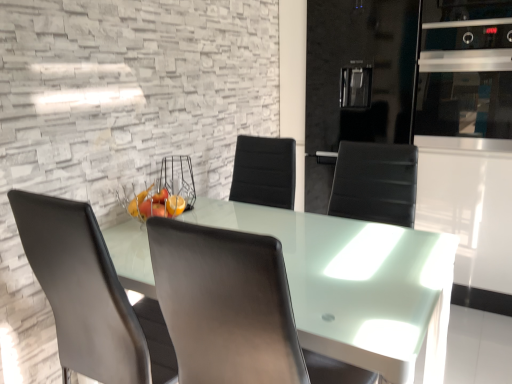
Question: Is black leather chair at center, arranged as the second chair when viewed from the left, closer to camera compared to matte gray chair at center, the first chair positioned from the left?

Choices:
 (A) no
 (B) yes

Answer: (B)

Question: Is black leather chair at center, positioned as the 1th chair in right-to-left order, facing towards matte gray chair at center, the first chair positioned from the left?

Choices:
 (A) no
 (B) yes

Answer: (A)

Question: Considering the relative positions of black leather chair at center, positioned as the 1th chair in right-to-left order, and matte gray chair at center, the 2th chair in the right-to-left sequence, in the image provided, is black leather chair at center, positioned as the 1th chair in right-to-left order, to the left of matte gray chair at center, the 2th chair in the right-to-left sequence, from the viewer's perspective?

Choices:
 (A) no
 (B) yes

Answer: (A)

Question: From the image's perspective, would you say black leather chair at center, positioned as the 1th chair in right-to-left order, is positioned over matte gray chair at center, the 2th chair in the right-to-left sequence?

Choices:
 (A) yes
 (B) no

Answer: (A)

Question: Is black leather chair at center, positioned as the 1th chair in right-to-left order, shorter than matte gray chair at center, the 2th chair in the right-to-left sequence?

Choices:
 (A) yes
 (B) no

Answer: (A)

Question: From a real-world perspective, is matte gray chair at center, the 2th chair in the right-to-left sequence, physically located above or below black leather chair at center, arranged as the second chair when viewed from the left?

Choices:
 (A) above
 (B) below

Answer: (B)

Question: Would you say matte gray chair at center, the first chair positioned from the left, is to the left or to the right of black leather chair at center, positioned as the 1th chair in right-to-left order, in the picture?

Choices:
 (A) right
 (B) left

Answer: (B)

Question: Is matte gray chair at center, the 2th chair in the right-to-left sequence, in front of or behind black leather chair at center, arranged as the second chair when viewed from the left, in the image?

Choices:
 (A) behind
 (B) front

Answer: (A)

Question: Looking at the image, does matte gray chair at center, the first chair positioned from the left, seem bigger or smaller compared to black leather chair at center, positioned as the 1th chair in right-to-left order?

Choices:
 (A) big
 (B) small

Answer: (B)

Question: From a real-world perspective, relative to black leather chair at center, arranged as the second chair when viewed from the left, is satin silver oven at upper right vertically above or below?

Choices:
 (A) below
 (B) above

Answer: (B)

Question: Does point (456, 104) appear closer or farther from the camera than point (175, 268)?

Choices:
 (A) farther
 (B) closer

Answer: (A)

Question: Based on their positions, is satin silver oven at upper right located to the left or right of black leather chair at center, positioned as the 1th chair in right-to-left order?

Choices:
 (A) left
 (B) right

Answer: (B)

Question: Is satin silver oven at upper right situated inside black leather chair at center, positioned as the 1th chair in right-to-left order, or outside?

Choices:
 (A) outside
 (B) inside

Answer: (A)

Question: Is point (93, 236) closer or farther from the camera than point (450, 89)?

Choices:
 (A) farther
 (B) closer

Answer: (B)

Question: From the image's perspective, is matte gray chair at center, the 2th chair in the right-to-left sequence, above or below satin silver oven at upper right?

Choices:
 (A) below
 (B) above

Answer: (A)